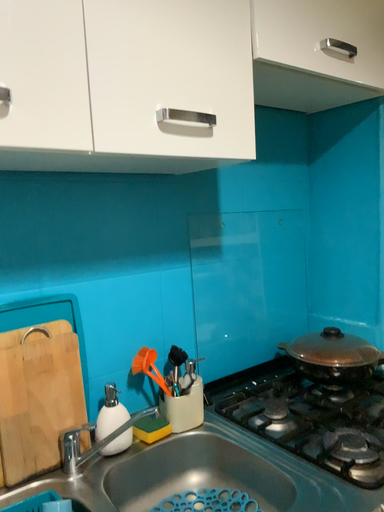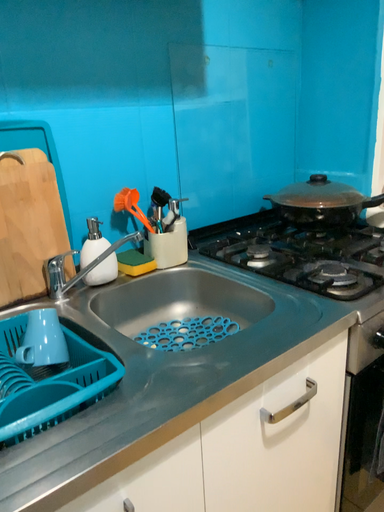
Question: Which way did the camera rotate in the video?

Choices:
 (A) rotated upward
 (B) rotated downward

Answer: (B)